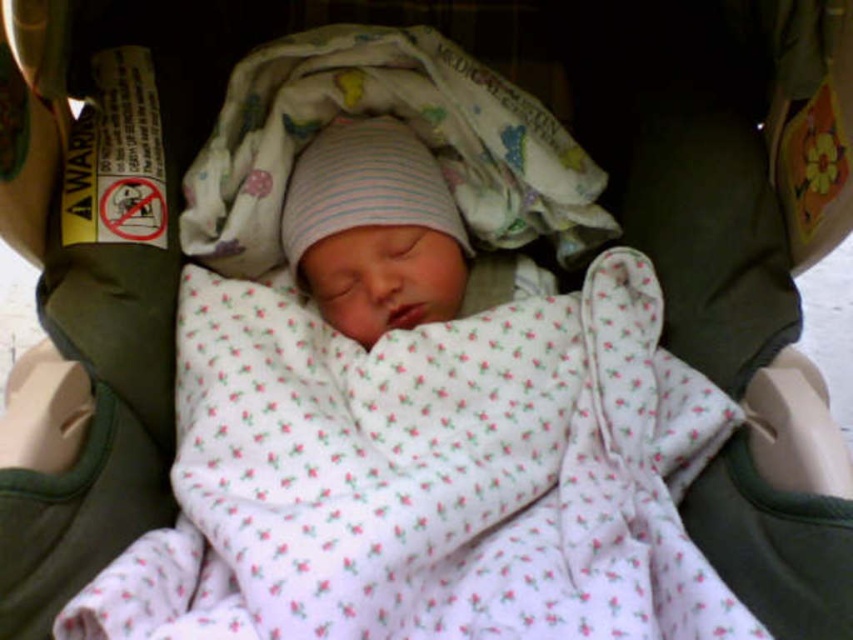
Is white floral fabric at center smaller than white striped knit hat at center?

No, white floral fabric at center is not smaller than white striped knit hat at center.

Between point (537, 464) and point (389, 160), which one is positioned behind?

Positioned behind is point (389, 160).

Is point (641, 410) positioned before point (357, 147)?

Yes.

At what (x,y) coordinates should I click in order to perform the action: click on white floral fabric at center. Please return your answer as a coordinate pair (x, y). The height and width of the screenshot is (640, 853). Looking at the image, I should click on (427, 476).

Between point (488, 112) and point (425, 196), which one is positioned in front?

Point (425, 196) is more forward.

The width and height of the screenshot is (853, 640). What are the coordinates of `white cotton blanket at center` in the screenshot? It's located at (401, 118).

Which is behind, point (430, 540) or point (410, 76)?

The point (410, 76) is more distant.

Can you confirm if white floral fabric at center is positioned below white cotton blanket at center?

Correct, white floral fabric at center is located below white cotton blanket at center.

From the picture: Measure the distance between white floral fabric at center and camera.

A distance of 20.21 inches exists between white floral fabric at center and camera.

The image size is (853, 640). I want to click on white floral fabric at center, so click(x=427, y=476).